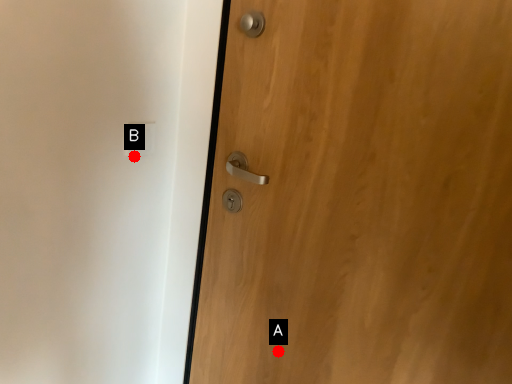
Question: Two points are circled on the image, labeled by A and B beside each circle. Which of the following is the farthest from the observer?

Choices:
 (A) A is further
 (B) B is further

Answer: (B)